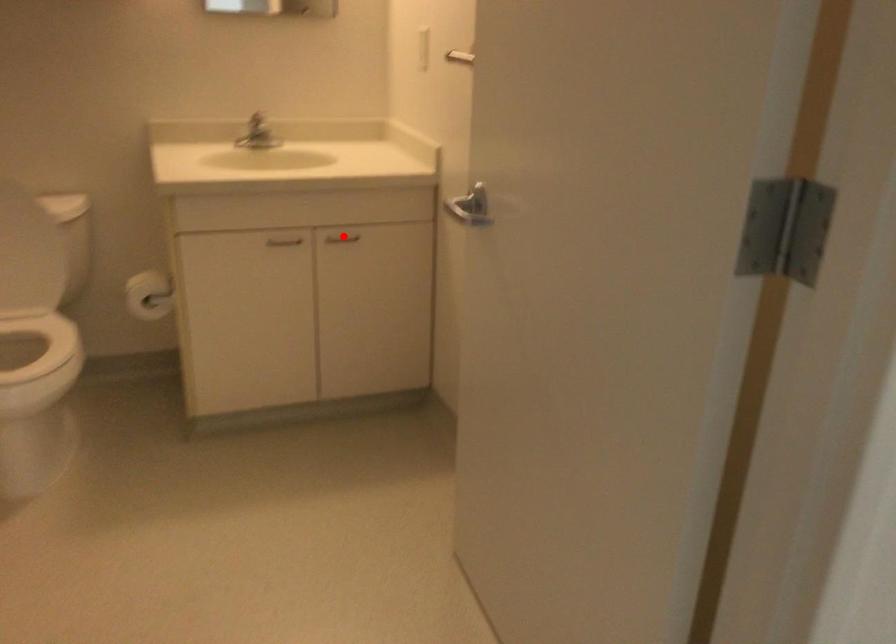
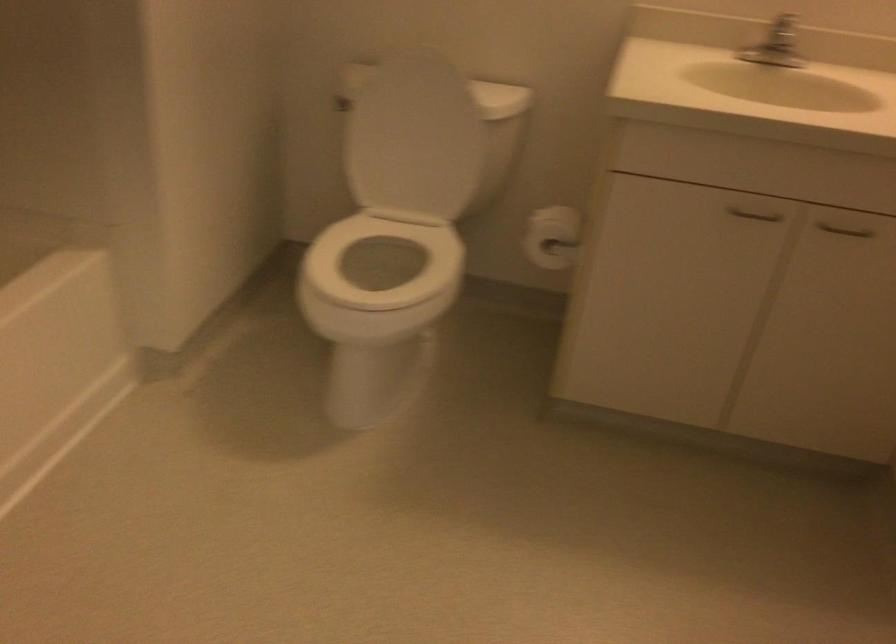
In the second image, find the point that corresponds to the highlighted location in the first image.

(845, 230)